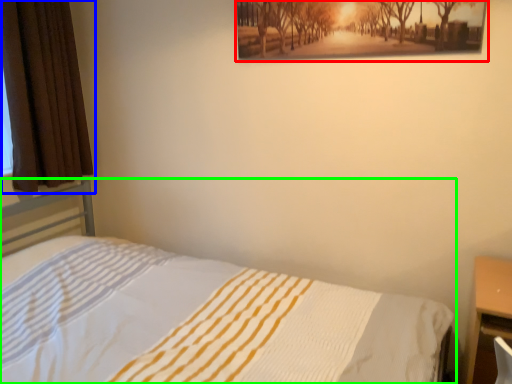
Question: Based on their relative distances, which object is farther from picture frame (highlighted by a red box)? Choose from curtain (highlighted by a blue box) and bed (highlighted by a green box).

Choices:
 (A) curtain
 (B) bed

Answer: (A)